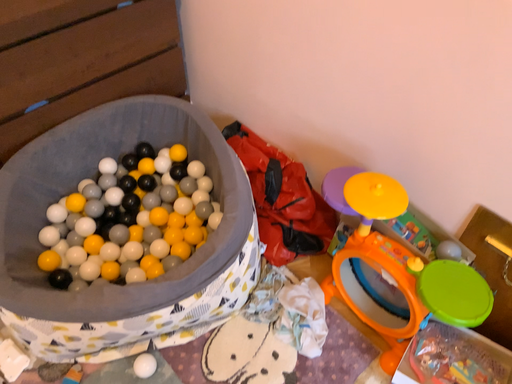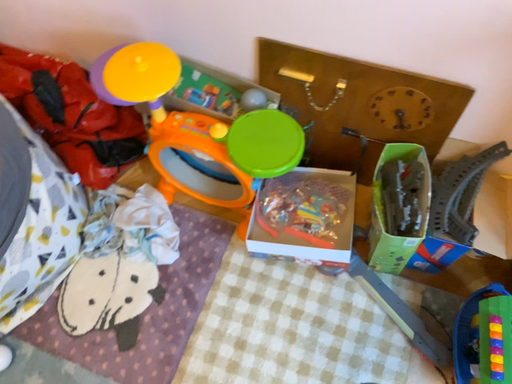
Question: Which way did the camera rotate in the video?

Choices:
 (A) rotated upward
 (B) rotated downward

Answer: (B)